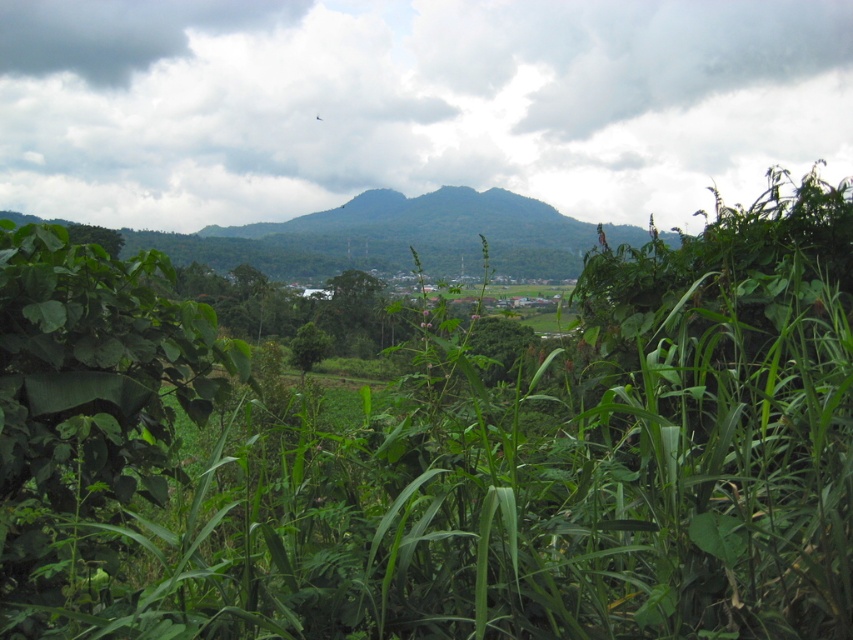
Question: Which of the following is the closest to the observer?

Choices:
 (A) 788,28
 (B) 209,458

Answer: (B)

Question: In this image, where is green leafy jungle at center located relative to cloudy sky at upper center?

Choices:
 (A) right
 (B) left

Answer: (A)

Question: Is the position of green leafy jungle at center less distant than that of cloudy sky at upper center?

Choices:
 (A) yes
 (B) no

Answer: (A)

Question: Considering the relative positions of green leafy jungle at center and cloudy sky at upper center in the image provided, where is green leafy jungle at center located with respect to cloudy sky at upper center?

Choices:
 (A) right
 (B) left

Answer: (A)